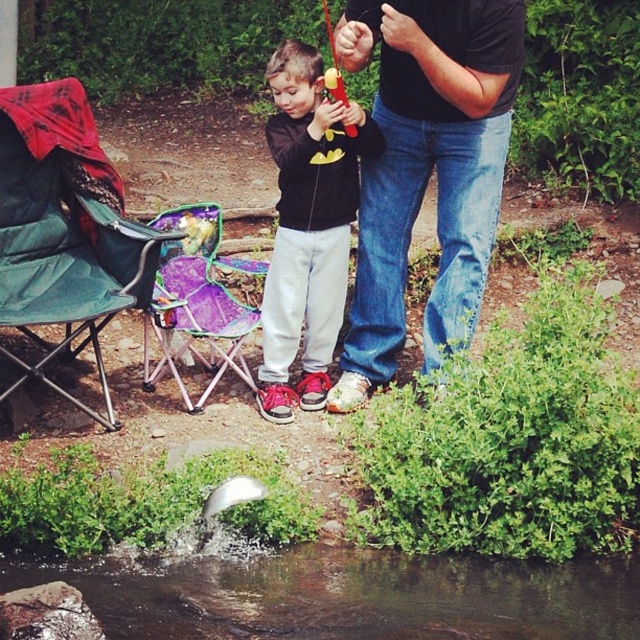
Between point (452, 307) and point (72, 131), which one is positioned behind?

Positioned behind is point (452, 307).

Is jeans at center above green fabric chair at left?

Yes, jeans at center is above green fabric chair at left.

Is point (442, 211) positioned before point (92, 268)?

Yes, point (442, 211) is closer to viewer.

Find the location of `jeans at center`. jeans at center is located at coordinates (426, 168).

Which is behind, point (605, 612) or point (268, 317)?

The point (268, 317) is more distant.

Find the location of a particular element. Image resolution: width=640 pixels, height=640 pixels. clear water at lower center is located at coordinates (353, 596).

Between point (212, 561) and point (352, 113), which one is positioned in front?

Positioned in front is point (212, 561).

The image size is (640, 640). Find the location of `clear water at lower center`. clear water at lower center is located at coordinates (353, 596).

Where is `jeans at center`? This screenshot has width=640, height=640. jeans at center is located at coordinates (426, 168).

Can you confirm if jeans at center is positioned above purple fabric chair at lower center?

Indeed, jeans at center is positioned over purple fabric chair at lower center.

Does point (424, 93) lie behind point (166, 250)?

No, (424, 93) is in front of (166, 250).

You are a GUI agent. You are given a task and a screenshot of the screen. Output one action in this format:
    pyautogui.click(x=<x>, y=<y>)
    Task: Click on the jeans at center
    
    Given the screenshot: What is the action you would take?
    point(426,168)